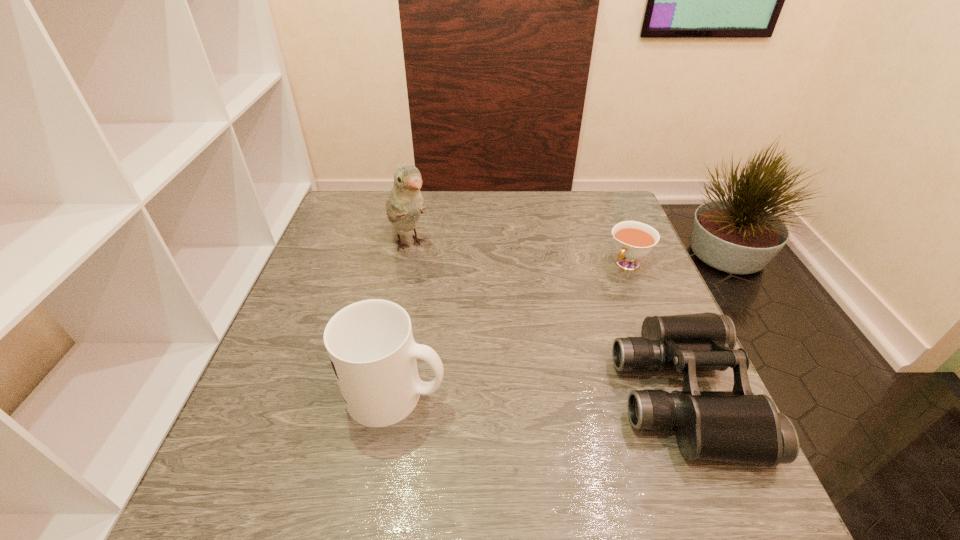
The height and width of the screenshot is (540, 960). What are the coordinates of `free spot that satisfies the following two spatial constraints: 1. on the front side of the tallest object; 2. on the left side of the shortest object` in the screenshot? It's located at (405, 264).

What are the coordinates of `free space that satisfies the following two spatial constraints: 1. on the front side of the mug; 2. on the handle side of the tallest object` in the screenshot? It's located at (378, 394).

This screenshot has height=540, width=960. I want to click on vacant area in the image that satisfies the following two spatial constraints: 1. on the front side of the binoculars; 2. on the front-facing side of the tallest object, so click(x=378, y=394).